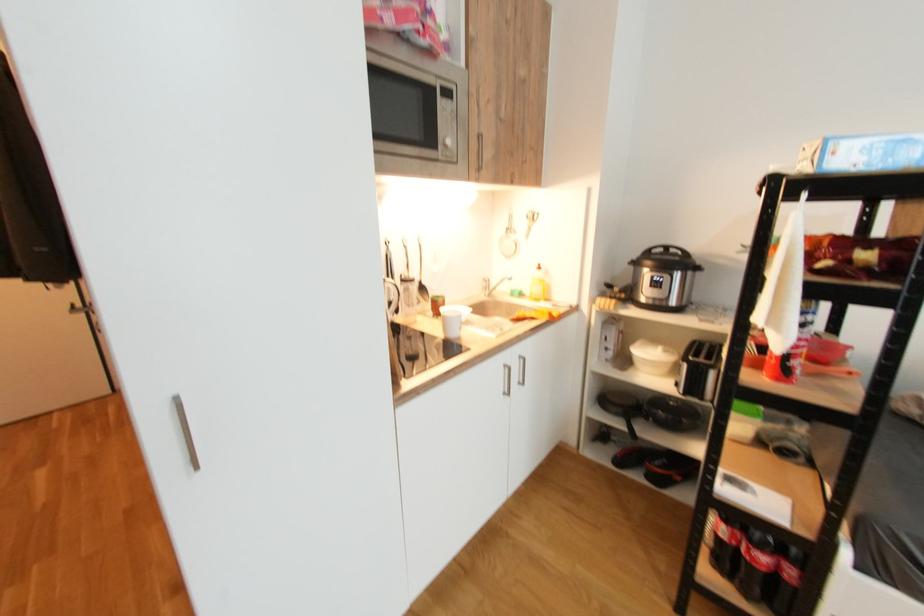
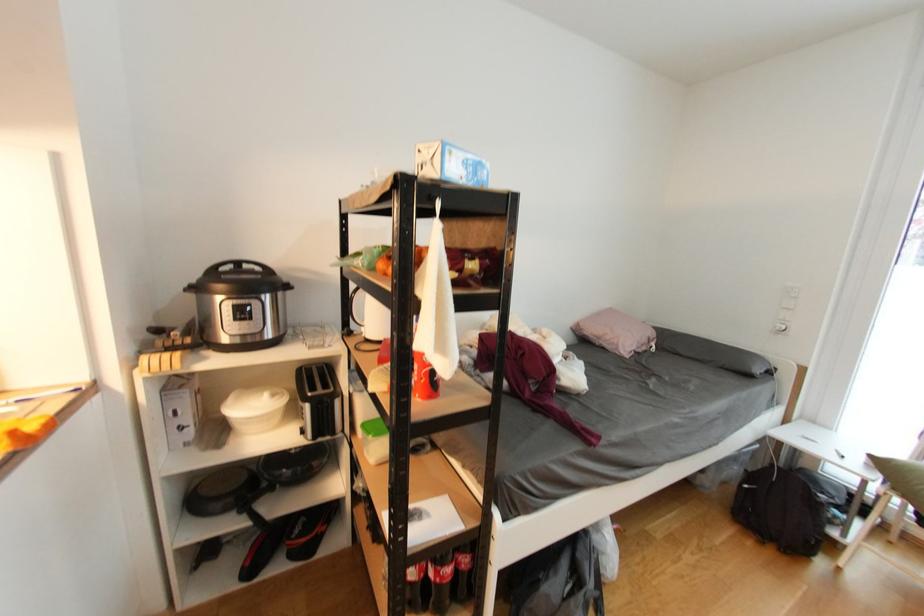
Question: The camera is either moving clockwise (left) or counter-clockwise (right) around the object. The first image is from the beginning of the video and the second image is from the end. Is the camera moving left or right when shooting the video?

Choices:
 (A) Left
 (B) Right

Answer: (A)